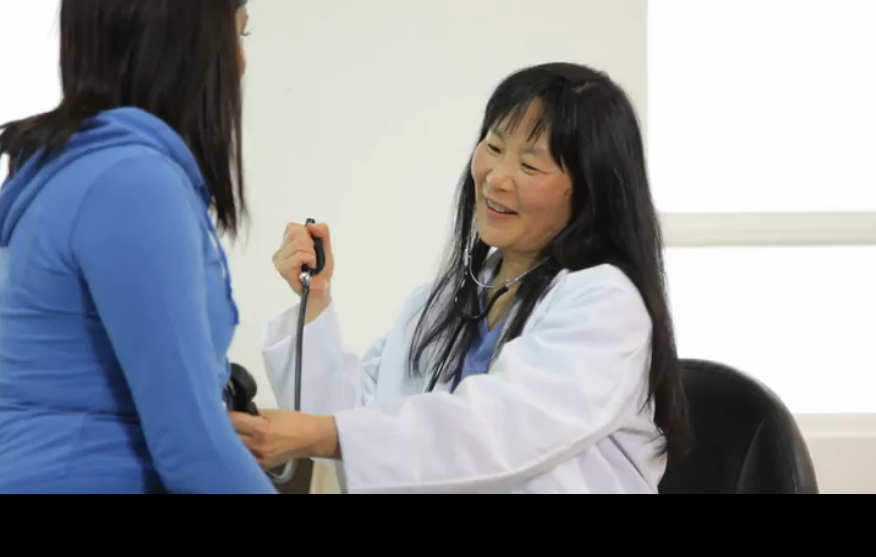
Locate an element on the screen. hood is located at coordinates (13, 184).